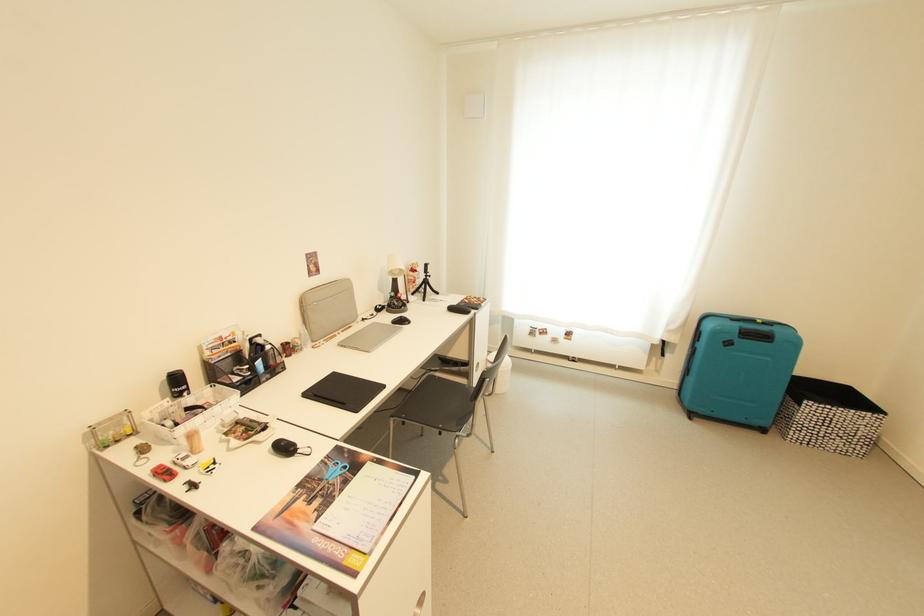
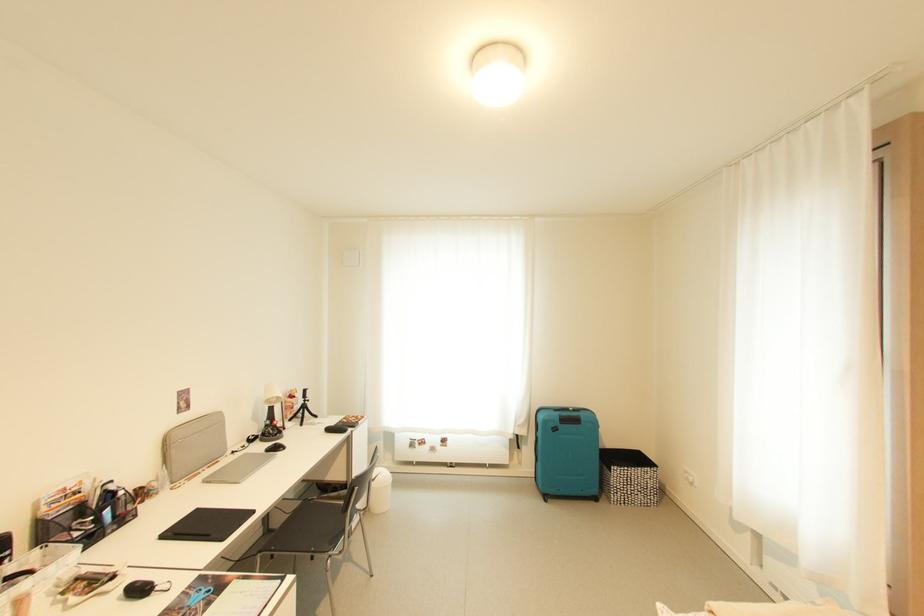
In the second image, find the point that corresponds to [764,323] in the first image.

(576, 411)